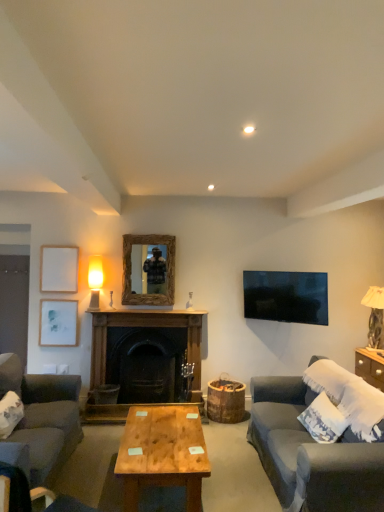
Question: Is dark wood fireplace at center not within natural wood coffee table at center?

Choices:
 (A) yes
 (B) no

Answer: (A)

Question: From the image's perspective, does dark wood fireplace at center appear lower than natural wood coffee table at center?

Choices:
 (A) yes
 (B) no

Answer: (B)

Question: From a real-world perspective, does dark wood fireplace at center stand above natural wood coffee table at center?

Choices:
 (A) yes
 (B) no

Answer: (A)

Question: Can you confirm if dark wood fireplace at center is smaller than natural wood coffee table at center?

Choices:
 (A) no
 (B) yes

Answer: (A)

Question: Does dark wood fireplace at center have a greater width compared to natural wood coffee table at center?

Choices:
 (A) yes
 (B) no

Answer: (B)

Question: Does dark wood fireplace at center appear on the right side of natural wood coffee table at center?

Choices:
 (A) yes
 (B) no

Answer: (B)

Question: Considering the relative positions of white matte picture frame at upper left, marked as the 2th picture frame in a top-to-bottom arrangement, and dark gray fabric chair at lower left in the image provided, is white matte picture frame at upper left, marked as the 2th picture frame in a top-to-bottom arrangement, to the left of dark gray fabric chair at lower left from the viewer's perspective?

Choices:
 (A) no
 (B) yes

Answer: (B)

Question: Is white matte picture frame at upper left, marked as the 2th picture frame in a top-to-bottom arrangement, positioned in front of dark gray fabric chair at lower left?

Choices:
 (A) no
 (B) yes

Answer: (A)

Question: From a real-world perspective, is white matte picture frame at upper left, positioned as the first picture frame in bottom-to-top order, on top of dark gray fabric chair at lower left?

Choices:
 (A) yes
 (B) no

Answer: (A)

Question: Does white matte picture frame at upper left, marked as the 2th picture frame in a top-to-bottom arrangement, have a greater width compared to dark gray fabric chair at lower left?

Choices:
 (A) no
 (B) yes

Answer: (A)

Question: Is dark gray fabric chair at lower left located within white matte picture frame at upper left, marked as the 2th picture frame in a top-to-bottom arrangement?

Choices:
 (A) no
 (B) yes

Answer: (A)

Question: Is white matte picture frame at upper left, positioned as the first picture frame in bottom-to-top order, thinner than dark gray fabric chair at lower left?

Choices:
 (A) yes
 (B) no

Answer: (A)

Question: Can you confirm if dark gray fabric couch at lower right, the second studio couch positioned from the left, is taller than dark gray fabric couch at lower left, which ranks as the 2th studio couch in right-to-left order?

Choices:
 (A) yes
 (B) no

Answer: (B)